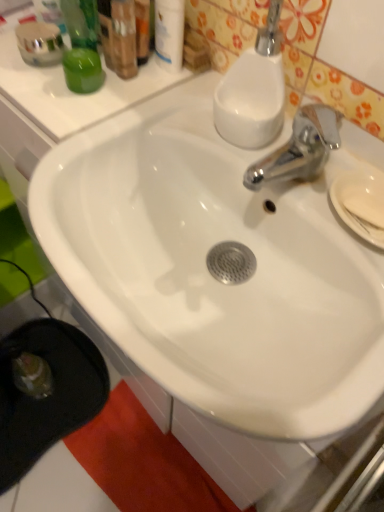
Question: Considering the relative sizes of white glossy soap dispenser at upper right and white glossy lotion at upper center in the image provided, is white glossy soap dispenser at upper right smaller than white glossy lotion at upper center?

Choices:
 (A) no
 (B) yes

Answer: (A)

Question: Is the position of white glossy soap dispenser at upper right more distant than that of white glossy lotion at upper center?

Choices:
 (A) no
 (B) yes

Answer: (A)

Question: Would you say white glossy soap dispenser at upper right is outside white glossy lotion at upper center?

Choices:
 (A) yes
 (B) no

Answer: (A)

Question: From the image's perspective, is white glossy soap dispenser at upper right located beneath white glossy lotion at upper center?

Choices:
 (A) yes
 (B) no

Answer: (A)

Question: Can you confirm if white glossy soap dispenser at upper right is thinner than white glossy lotion at upper center?

Choices:
 (A) no
 (B) yes

Answer: (A)

Question: Is white glossy lotion at upper center in front of or behind green matte jar at upper left in the image?

Choices:
 (A) behind
 (B) front

Answer: (B)

Question: Looking at their shapes, would you say white glossy lotion at upper center is wider or thinner than green matte jar at upper left?

Choices:
 (A) wide
 (B) thin

Answer: (B)

Question: Choose the correct answer: Is white glossy lotion at upper center inside green matte jar at upper left or outside it?

Choices:
 (A) outside
 (B) inside

Answer: (A)

Question: Considering the positions of white glossy lotion at upper center and green matte jar at upper left in the image, is white glossy lotion at upper center taller or shorter than green matte jar at upper left?

Choices:
 (A) tall
 (B) short

Answer: (A)

Question: Visually, is white matte soap at right positioned to the left or to the right of green matte jar at upper left?

Choices:
 (A) right
 (B) left

Answer: (A)

Question: From the image's perspective, is white matte soap at right located above or below green matte jar at upper left?

Choices:
 (A) above
 (B) below

Answer: (B)

Question: Considering the positions of white matte soap at right and green matte jar at upper left in the image, is white matte soap at right bigger or smaller than green matte jar at upper left?

Choices:
 (A) big
 (B) small

Answer: (B)

Question: Is point tap(349, 197) positioned closer to the camera than point tap(87, 56)?

Choices:
 (A) farther
 (B) closer

Answer: (B)

Question: Is point (218, 501) positioned closer to the camera than point (92, 58)?

Choices:
 (A) farther
 (B) closer

Answer: (A)

Question: In terms of size, does red cotton beach towel at lower left appear bigger or smaller than green matte jar at upper left?

Choices:
 (A) big
 (B) small

Answer: (A)